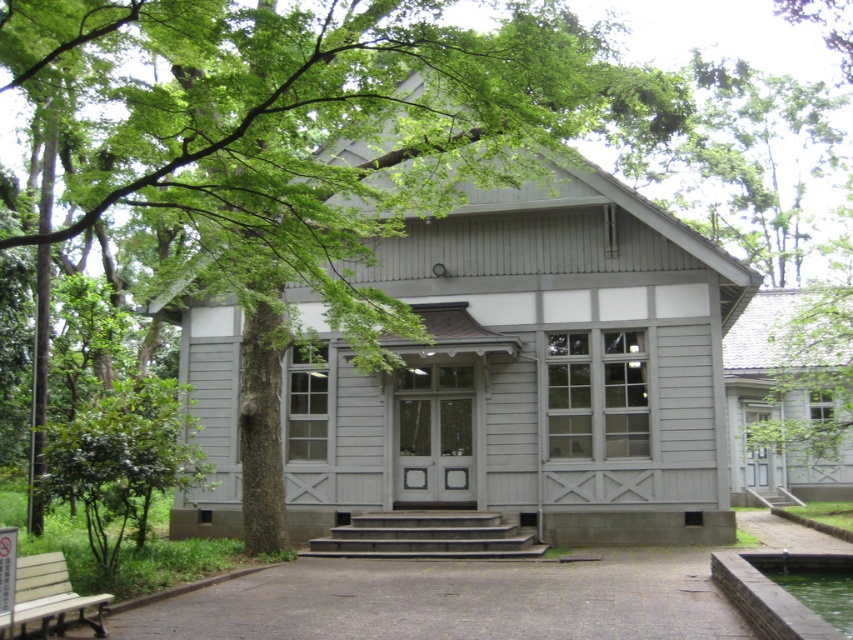
You are planning to place a new flower pot between the green leafy tree at center and the wooden bench at lower left. Considering their widths, which object should the flower pot be closer to?

The flower pot should be closer to the wooden bench at lower left because the green leafy tree at center is wider than the wooden bench at lower left, so placing it closer to the narrower object would balance the space.

You are standing at the wooden bench at lower left and want to walk towards the green leafy tree at center. Which direction should you move?

The green leafy tree at center is to the right of the wooden bench at lower left, so you should move to the right to reach it.

You are standing in front of the traditional house and want to locate two specific points marked on the building. The first point is at coordinate point(312,545) and the second is at point(15,605). Which of these points is closer to your current position?

Point(312,545) is further to the camera than point(15,605), so the point closer to your position is point(15,605).